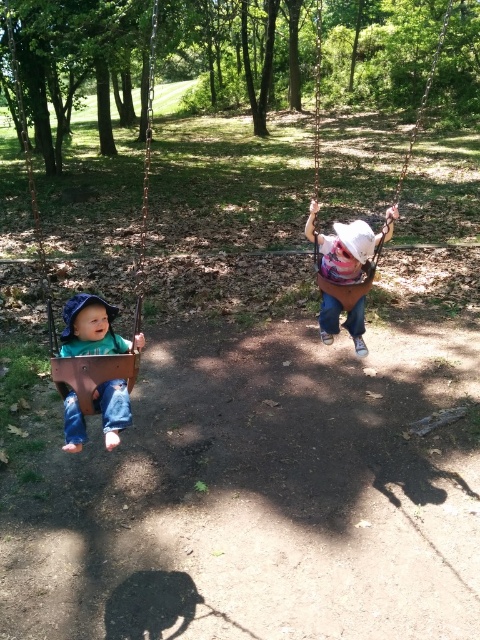
Question: Estimate the real-world distances between objects in this image. Which object is closer to the matte green shirt at left?

Choices:
 (A) rusty metal swing at left
 (B) denim jeans at center
 (C) brown leather swing at upper right

Answer: (B)

Question: Is matte green shirt at left further to camera compared to denim jeans at center?

Choices:
 (A) yes
 (B) no

Answer: (B)

Question: Is rusty metal swing at left to the left of matte green shirt at left from the viewer's perspective?

Choices:
 (A) no
 (B) yes

Answer: (B)

Question: Is rusty metal swing at left bigger than brown leather swing at upper right?

Choices:
 (A) yes
 (B) no

Answer: (B)

Question: Which object is positioned farthest from the matte green shirt at left?

Choices:
 (A) rusty metal swing at left
 (B) brown leather swing at upper right

Answer: (B)

Question: Estimate the real-world distances between objects in this image. Which object is closer to the rusty metal swing at left?

Choices:
 (A) matte green shirt at left
 (B) denim jeans at center

Answer: (A)